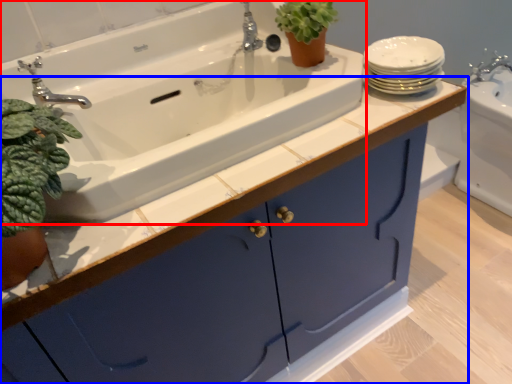
Question: Which point is further to the camera, sink (highlighted by a red box) or bathroom cabinet (highlighted by a blue box)?

Choices:
 (A) sink
 (B) bathroom cabinet

Answer: (A)